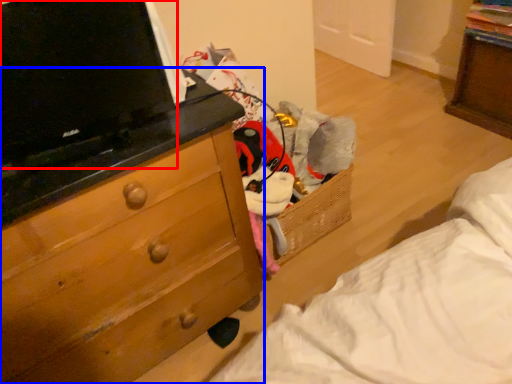
Question: Which of the following is the farthest to the observer, computer (highlighted by a red box) or chest of drawers (highlighted by a blue box)?

Choices:
 (A) computer
 (B) chest of drawers

Answer: (A)